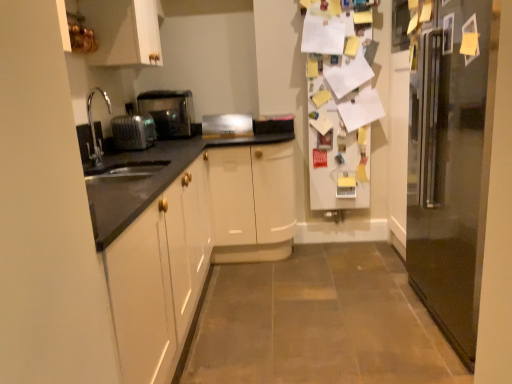
You are a GUI agent. You are given a task and a screenshot of the screen. Output one action in this format:
    pyautogui.click(x=<x>, y=<y>)
    Task: Click on the satin silver toaster at left
    The width and height of the screenshot is (512, 384).
    Given the screenshot: What is the action you would take?
    pyautogui.click(x=168, y=111)

From the picture: Measure the distance between satin silver toaster at left and camera.

A distance of 3.06 meters exists between satin silver toaster at left and camera.

Measure the distance between point (x=123, y=33) and camera.

The distance of point (x=123, y=33) from camera is 2.44 meters.

Measure the distance between point [226,126] and camera.

The distance of point [226,126] from camera is 3.15 meters.

Find the location of `metallic stainless steel refrigerator at right`. metallic stainless steel refrigerator at right is located at coordinates (451, 165).

From the image's perspective, does satin silver toaster at left, the 1th appliance when ordered from front to back, appear higher than satin silver toaster at center, the 1th appliance from the back?

Actually, satin silver toaster at left, the 1th appliance when ordered from front to back, appears below satin silver toaster at center, the 1th appliance from the back, in the image.

Who is more distant, satin silver toaster at left, the 1th appliance when ordered from front to back, or satin silver toaster at center, the 1th appliance from the back?

satin silver toaster at center, the 1th appliance from the back.

Which of these two, satin silver toaster at left, which appears as the second appliance when viewed from the back, or satin silver toaster at center, the second appliance positioned from the left, is bigger?

satin silver toaster at left, which appears as the second appliance when viewed from the back.

Identify the location of appliance on the left of satin silver toaster at center, placed as the first appliance when sorted from right to left. (133, 132).

From a real-world perspective, is white glossy cabinet at upper left on metallic stainless steel refrigerator at right?

Yes.

Which is correct: white glossy cabinet at upper left is inside metallic stainless steel refrigerator at right, or outside of it?

white glossy cabinet at upper left lies outside metallic stainless steel refrigerator at right.

This screenshot has width=512, height=384. What are the coordinates of `cabinetry above the metallic stainless steel refrigerator at right (from the image's perspective)` in the screenshot? It's located at [x=123, y=32].

Considering the sizes of objects white glossy cabinet at upper left and metallic stainless steel refrigerator at right in the image provided, who is smaller, white glossy cabinet at upper left or metallic stainless steel refrigerator at right?

With smaller size is white glossy cabinet at upper left.

Is the position of satin silver toaster at left, which appears as the second appliance when viewed from the back, more distant than that of metallic stainless steel refrigerator at right?

Yes.

Choose the correct answer: Is satin silver toaster at left, which is the 2th appliance in right-to-left order, inside metallic stainless steel refrigerator at right or outside it?

satin silver toaster at left, which is the 2th appliance in right-to-left order, exists outside the volume of metallic stainless steel refrigerator at right.

Is satin silver toaster at left, which appears as the second appliance when viewed from the back, positioned with its back to metallic stainless steel refrigerator at right?

No, satin silver toaster at left, which appears as the second appliance when viewed from the back, is not facing away from metallic stainless steel refrigerator at right.

Are satin silver toaster at left and satin silver toaster at center, placed as the first appliance when sorted from right to left, far apart?

No, satin silver toaster at left is not far from satin silver toaster at center, placed as the first appliance when sorted from right to left.

From a real-world perspective, is satin silver toaster at left physically located above or below satin silver toaster at center, the second appliance positioned from the left?

From a real-world perspective, satin silver toaster at left is physically above satin silver toaster at center, the second appliance positioned from the left.

Which object is wider, satin silver toaster at left or satin silver toaster at center, the second appliance positioned from the left?

satin silver toaster at left is wider.

Is satin silver toaster at left turned away from satin silver toaster at center, the 1th appliance from the back?

No, satin silver toaster at left is not facing the opposite direction of satin silver toaster at center, the 1th appliance from the back.

From a real-world perspective, which is physically below, satin silver toaster at center, the second appliance viewed from the front, or metallic stainless steel refrigerator at right?

In real-world perspective, metallic stainless steel refrigerator at right is lower.

Looking at this image, from the image's perspective, is satin silver toaster at center, the second appliance positioned from the left, located beneath metallic stainless steel refrigerator at right?

No, from the image's perspective, satin silver toaster at center, the second appliance positioned from the left, is not below metallic stainless steel refrigerator at right.

Does satin silver toaster at center, the 1th appliance from the back, touch metallic stainless steel refrigerator at right?

No, satin silver toaster at center, the 1th appliance from the back, is not next to metallic stainless steel refrigerator at right.

Which of these two, satin silver toaster at center, placed as the first appliance when sorted from right to left, or metallic stainless steel refrigerator at right, is wider?

metallic stainless steel refrigerator at right is wider.

How many degrees apart are the facing directions of metallic stainless steel refrigerator at right and white glossy cabinet at upper left?

The angular difference between metallic stainless steel refrigerator at right and white glossy cabinet at upper left is 180 degrees.

Could you tell me if metallic stainless steel refrigerator at right is turned towards white glossy cabinet at upper left?

Yes, metallic stainless steel refrigerator at right is oriented towards white glossy cabinet at upper left.

Considering the positions of points (430, 288) and (103, 42), is point (430, 288) farther from camera compared to point (103, 42)?

No, it is not.

Which is behind, metallic stainless steel refrigerator at right or white glossy cabinet at upper left?

metallic stainless steel refrigerator at right is further from the camera.

Is satin silver toaster at center, the second appliance viewed from the front, to the left or to the right of satin silver toaster at left, which appears as the second appliance when viewed from the back, in the image?

satin silver toaster at center, the second appliance viewed from the front, is to the right of satin silver toaster at left, which appears as the second appliance when viewed from the back.

Does satin silver toaster at center, the second appliance positioned from the left, touch satin silver toaster at left, which is the 1th appliance in left-to-right order?

There is a gap between satin silver toaster at center, the second appliance positioned from the left, and satin silver toaster at left, which is the 1th appliance in left-to-right order.

From their relative heights in the image, would you say satin silver toaster at center, placed as the first appliance when sorted from right to left, is taller or shorter than satin silver toaster at left, which is the 1th appliance in left-to-right order?

satin silver toaster at center, placed as the first appliance when sorted from right to left, is shorter than satin silver toaster at left, which is the 1th appliance in left-to-right order.

Where is `appliance lying on the left of satin silver toaster at center, the second appliance viewed from the front`? appliance lying on the left of satin silver toaster at center, the second appliance viewed from the front is located at coordinates (133, 132).

Find the location of a particular element. The height and width of the screenshot is (384, 512). refrigerator lying behind the white glossy cabinet at upper left is located at coordinates (451, 165).

In the scene shown: From the image, which object appears to be farther from satin silver toaster at center, the second appliance viewed from the front, metallic stainless steel refrigerator at right or satin silver toaster at left?

metallic stainless steel refrigerator at right is positioned further to the anchor satin silver toaster at center, the second appliance viewed from the front.

Based on their spatial positions, is satin silver toaster at left, which is the 2th appliance in right-to-left order, or satin silver toaster at center, the second appliance viewed from the front, closer to satin silver toaster at left?

Based on the image, satin silver toaster at center, the second appliance viewed from the front, appears to be nearer to satin silver toaster at left.

Estimate the real-world distances between objects in this image. Which object is further from white glossy cabinet at upper left, satin silver toaster at left, which appears as the second appliance when viewed from the back, or satin silver toaster at left?

Among the two, satin silver toaster at left is located further to white glossy cabinet at upper left.

When comparing their distances from metallic stainless steel refrigerator at right, does white glossy cabinet at upper left or satin silver toaster at left, which is the 2th appliance in right-to-left order, seem closer?

The object closer to metallic stainless steel refrigerator at right is satin silver toaster at left, which is the 2th appliance in right-to-left order.

Estimate the real-world distances between objects in this image. Which object is further from satin silver toaster at left, satin silver toaster at center, the 1th appliance from the back, or metallic stainless steel refrigerator at right?

Among the two, metallic stainless steel refrigerator at right is located further to satin silver toaster at left.

When comparing their distances from metallic stainless steel refrigerator at right, does satin silver toaster at center, placed as the first appliance when sorted from right to left, or satin silver toaster at left, which is the 1th appliance in left-to-right order, seem further?

satin silver toaster at left, which is the 1th appliance in left-to-right order, lies further to metallic stainless steel refrigerator at right than the other object.

Which object lies further to the anchor point satin silver toaster at left, which is the 2th appliance in right-to-left order, satin silver toaster at left or white glossy cabinet at upper left?

The object further to satin silver toaster at left, which is the 2th appliance in right-to-left order, is satin silver toaster at left.

When comparing their distances from satin silver toaster at left, which appears as the second appliance when viewed from the back, does satin silver toaster at center, placed as the first appliance when sorted from right to left, or white glossy cabinet at upper left seem further?

The object further to satin silver toaster at left, which appears as the second appliance when viewed from the back, is satin silver toaster at center, placed as the first appliance when sorted from right to left.

Where is `appliance located between satin silver toaster at left, which is the 1th appliance in left-to-right order, and metallic stainless steel refrigerator at right in the left-right direction`? The image size is (512, 384). appliance located between satin silver toaster at left, which is the 1th appliance in left-to-right order, and metallic stainless steel refrigerator at right in the left-right direction is located at coordinates (227, 126).

Where is `home appliance between white glossy cabinet at upper left and metallic stainless steel refrigerator at right in the horizontal direction`? home appliance between white glossy cabinet at upper left and metallic stainless steel refrigerator at right in the horizontal direction is located at coordinates (168, 111).

Identify the location of appliance between white glossy cabinet at upper left and satin silver toaster at center, the 1th appliance from the back, in the front-back direction. (133, 132).

Identify the location of home appliance between satin silver toaster at left, the 1th appliance when ordered from front to back, and satin silver toaster at center, the 1th appliance from the back, from left to right. The image size is (512, 384). (168, 111).